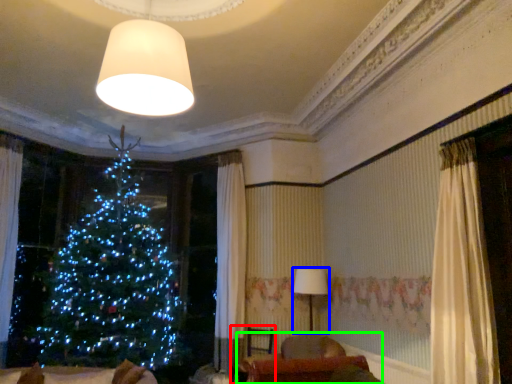
Question: Which is farther away from armchair (highlighted by a red box)? lamp (highlighted by a blue box) or furniture (highlighted by a green box)?

Choices:
 (A) lamp
 (B) furniture

Answer: (B)